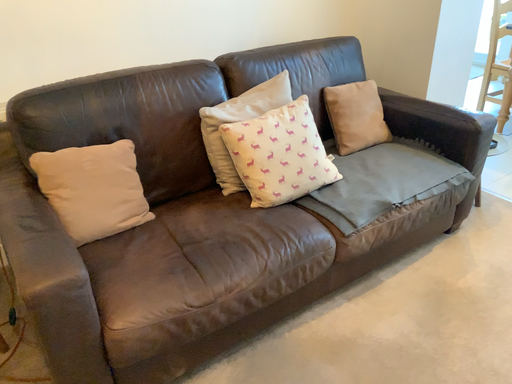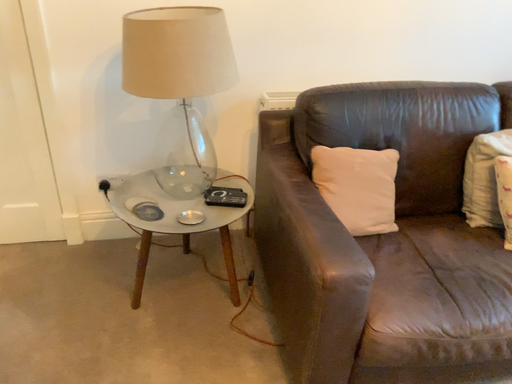
Question: Which way did the camera rotate in the video?

Choices:
 (A) rotated left
 (B) rotated right

Answer: (A)